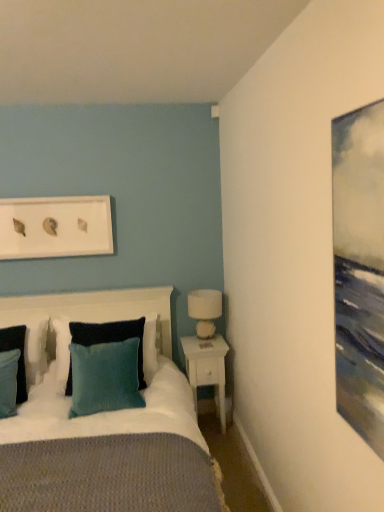
The width and height of the screenshot is (384, 512). Identify the location of velvet dark blue headboard at center. (95, 309).

Locate an element on the screen. The image size is (384, 512). white wood nightstand at lower right is located at coordinates (207, 368).

In order to click on teal velvet pillow at center, the first pillow in the right-to-left sequence in this screenshot , I will do `click(106, 342)`.

What is the approximate width of teal fabric pillow at left, the second pillow positioned from the right?

teal fabric pillow at left, the second pillow positioned from the right, is 13.22 inches in width.

Where is `teal fabric pillow at left, which appears as the first pillow when viewed from the left`? teal fabric pillow at left, which appears as the first pillow when viewed from the left is located at coordinates (35, 349).

Considering the relative sizes of velvet dark blue headboard at center and white matte picture frame at upper center in the image provided, is velvet dark blue headboard at center shorter than white matte picture frame at upper center?

No.

Does velvet dark blue headboard at center lie behind white matte picture frame at upper center?

No, velvet dark blue headboard at center is in front of white matte picture frame at upper center.

Who is smaller, velvet dark blue headboard at center or white matte picture frame at upper center?

With smaller size is white matte picture frame at upper center.

Based on the photo, is velvet dark blue headboard at center far away from white matte picture frame at upper center?

No, there isn't a large distance between velvet dark blue headboard at center and white matte picture frame at upper center.

Is point (63, 350) in front of point (22, 250)?

No, (63, 350) is behind (22, 250).

Can you tell me how much teal velvet pillow at center, arranged as the 3th pillow when viewed from the left, and white matte picture frame at upper center differ in facing direction?

The facing directions of teal velvet pillow at center, arranged as the 3th pillow when viewed from the left, and white matte picture frame at upper center are 0.404 degrees apart.

Locate an element on the screen. picture frame on the left of teal velvet pillow at center, the first pillow in the right-to-left sequence is located at coordinates (55, 227).

Considering the sizes of teal velvet pillow at center, arranged as the 3th pillow when viewed from the left, and white matte picture frame at upper center in the image, is teal velvet pillow at center, arranged as the 3th pillow when viewed from the left, wider or thinner than white matte picture frame at upper center?

Considering their sizes, teal velvet pillow at center, arranged as the 3th pillow when viewed from the left, looks broader than white matte picture frame at upper center.

Considering the relative sizes of velvet dark blue headboard at center and teal fabric pillow at left, which appears as the first pillow when viewed from the left, in the image provided, is velvet dark blue headboard at center taller than teal fabric pillow at left, which appears as the first pillow when viewed from the left,?

Yes.

Considering the relative sizes of velvet dark blue headboard at center and teal fabric pillow at left, which appears as the first pillow when viewed from the left, in the image provided, is velvet dark blue headboard at center smaller than teal fabric pillow at left, which appears as the first pillow when viewed from the left,?

Actually, velvet dark blue headboard at center might be larger than teal fabric pillow at left, which appears as the first pillow when viewed from the left.

Is the depth of velvet dark blue headboard at center greater than that of teal fabric pillow at left, which appears as the first pillow when viewed from the left?

That is False.

Which object is thinner, velvet dark blue headboard at center or teal fabric pillow at left, which appears as the first pillow when viewed from the left?

Thinner between the two is teal fabric pillow at left, which appears as the first pillow when viewed from the left.

Considering the sizes of objects teal fabric pillow at left, acting as the second pillow starting from the left, and teal fabric pillow at left, which appears as the first pillow when viewed from the left, in the image provided, who is wider, teal fabric pillow at left, acting as the second pillow starting from the left, or teal fabric pillow at left, which appears as the first pillow when viewed from the left,?

teal fabric pillow at left, acting as the second pillow starting from the left, is wider.

From a real-world perspective, is teal fabric pillow at left, acting as the second pillow starting from the left, located beneath teal fabric pillow at left, which is the third pillow from right to left?

Yes, from a real-world perspective, teal fabric pillow at left, acting as the second pillow starting from the left, is under teal fabric pillow at left, which is the third pillow from right to left.

How many degrees apart are the facing directions of teal fabric pillow at left, acting as the second pillow starting from the left, and teal fabric pillow at left, which appears as the first pillow when viewed from the left?

0.00263 degrees.

Is teal fabric pillow at left, acting as the second pillow starting from the left, aimed at teal fabric pillow at left, which is the third pillow from right to left?

No, teal fabric pillow at left, acting as the second pillow starting from the left, does not turn towards teal fabric pillow at left, which is the third pillow from right to left.

From the image's perspective, is white wood nightstand at lower right on top of velvet dark blue headboard at center?

Actually, white wood nightstand at lower right appears below velvet dark blue headboard at center in the image.

Is white wood nightstand at lower right taller or shorter than velvet dark blue headboard at center?

In the image, white wood nightstand at lower right appears to be taller than velvet dark blue headboard at center.

Would you consider white wood nightstand at lower right to be distant from velvet dark blue headboard at center?

They are positioned close to each other.

Is white wood nightstand at lower right closer to the viewer compared to teal fabric pillow at left, the second pillow positioned from the right?

No.

Based on their sizes in the image, would you say white wood nightstand at lower right is bigger or smaller than teal fabric pillow at left, the second pillow positioned from the right?

In the image, white wood nightstand at lower right appears to be larger than teal fabric pillow at left, the second pillow positioned from the right.

From a real-world perspective, which object rests below the other?

white wood nightstand at lower right, from a real-world perspective.

Could you tell me if white wood nightstand at lower right is facing teal fabric pillow at left, acting as the second pillow starting from the left?

No, white wood nightstand at lower right does not turn towards teal fabric pillow at left, acting as the second pillow starting from the left.

Could you tell me if teal fabric pillow at left, which appears as the first pillow when viewed from the left, is facing teal fabric pillow at left, the second pillow positioned from the right?

Yes, teal fabric pillow at left, which appears as the first pillow when viewed from the left, is aimed at teal fabric pillow at left, the second pillow positioned from the right.

Is teal fabric pillow at left, which appears as the first pillow when viewed from the left, not near teal fabric pillow at left, the second pillow positioned from the right?

That's not correct — teal fabric pillow at left, which appears as the first pillow when viewed from the left, is a little close to teal fabric pillow at left, the second pillow positioned from the right.

From a real-world perspective, who is located lower, teal fabric pillow at left, which is the third pillow from right to left, or teal fabric pillow at left, the second pillow positioned from the right?

teal fabric pillow at left, the second pillow positioned from the right, from a real-world perspective.

What's the angular difference between teal fabric pillow at left, which is the third pillow from right to left, and teal fabric pillow at left, acting as the second pillow starting from the left,'s facing directions?

0.00263 degrees.

Image resolution: width=384 pixels, height=512 pixels. Find the location of `picture frame above the velvet dark blue headboard at center (from the image's perspective)`. picture frame above the velvet dark blue headboard at center (from the image's perspective) is located at coordinates (55, 227).

Locate an element on the screen. the 2nd pillow in front of the white matte picture frame at upper center, counting from the anchor's position is located at coordinates (106, 342).

Consider the image. Based on their spatial positions, is teal fabric pillow at left, which is the third pillow from right to left, or white matte picture frame at upper center further from velvet dark blue headboard at center?

white matte picture frame at upper center is further to velvet dark blue headboard at center.

Considering their positions, is velvet dark blue headboard at center positioned further to white matte picture frame at upper center than white ceramic table lamp at right?

white ceramic table lamp at right lies further to white matte picture frame at upper center than the other object.

Looking at the image, which one is located closer to white ceramic table lamp at right, teal fabric pillow at left, the second pillow positioned from the right, or teal fabric pillow at left, which appears as the first pillow when viewed from the left?

Among the two, teal fabric pillow at left, which appears as the first pillow when viewed from the left, is located nearer to white ceramic table lamp at right.

From the image, which object appears to be farther from velvet dark blue headboard at center, teal fabric pillow at left, acting as the second pillow starting from the left, or white ceramic table lamp at right?

The object further to velvet dark blue headboard at center is teal fabric pillow at left, acting as the second pillow starting from the left.

Considering their positions, is teal fabric pillow at left, the second pillow positioned from the right, positioned further to white wood nightstand at lower right than velvet dark blue headboard at center?

teal fabric pillow at left, the second pillow positioned from the right, is positioned further to the anchor white wood nightstand at lower right.

Estimate the real-world distances between objects in this image. Which object is further from white ceramic table lamp at right, velvet dark blue headboard at center or white wood nightstand at lower right?

velvet dark blue headboard at center.

Based on their spatial positions, is teal fabric pillow at left, the second pillow positioned from the right, or white wood nightstand at lower right closer to white ceramic table lamp at right?

Based on the image, white wood nightstand at lower right appears to be nearer to white ceramic table lamp at right.

Estimate the real-world distances between objects in this image. Which object is closer to teal fabric pillow at left, which is the third pillow from right to left, teal fabric pillow at left, acting as the second pillow starting from the left, or white wood nightstand at lower right?

teal fabric pillow at left, acting as the second pillow starting from the left.

Where is `headboard located between teal fabric pillow at left, the second pillow positioned from the right, and white ceramic table lamp at right in the left-right direction`? headboard located between teal fabric pillow at left, the second pillow positioned from the right, and white ceramic table lamp at right in the left-right direction is located at coordinates (95, 309).

Locate an element on the screen. The width and height of the screenshot is (384, 512). picture frame between teal fabric pillow at left, which appears as the first pillow when viewed from the left, and white ceramic table lamp at right, in the horizontal direction is located at coordinates (55, 227).

You are a GUI agent. You are given a task and a screenshot of the screen. Output one action in this format:
    pyautogui.click(x=<x>, y=<y>)
    Task: Click on the pillow between teal fabric pillow at left, which appears as the first pillow when viewed from the left, and teal velvet pillow at center, the first pillow in the right-to-left sequence, from left to right
    
    Given the screenshot: What is the action you would take?
    pyautogui.click(x=19, y=358)

At what (x,y) coordinates should I click in order to perform the action: click on pillow located between white matte picture frame at upper center and white ceramic table lamp at right in the left-right direction. Please return your answer as a coordinate pair (x, y). Looking at the image, I should click on (106, 342).